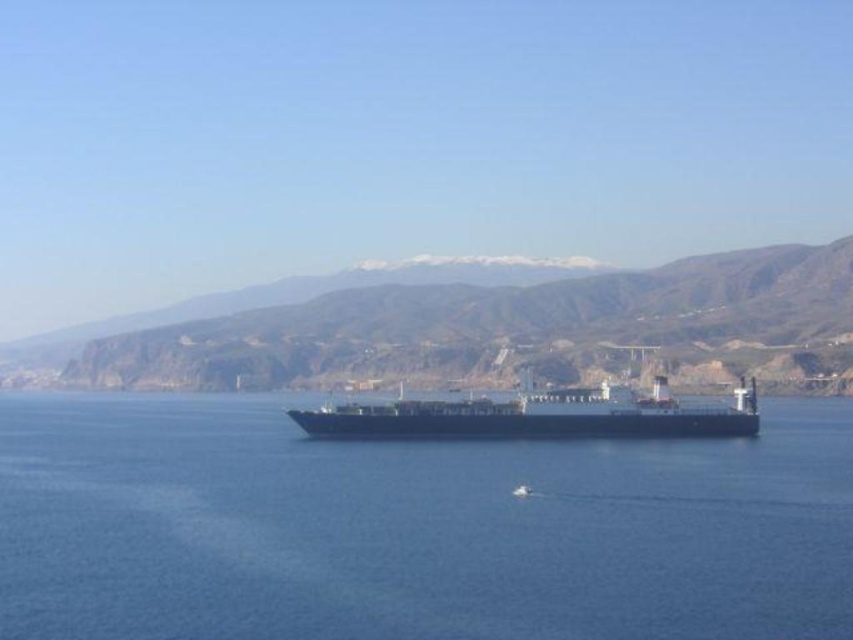
You are standing on the deck of the cargo ship and see two points marked in the image. The first point is at coordinates point (699, 580) and the second point is at point (222, 337). Which point is closer to you?

Point (699, 580) is in front of point (222, 337), so the first point is closer to you.

You are a marine biologist studying the water surface near the black matte cargo ship at center. You need to collect a water sample from the blue water at center. What is the minimum distance you must travel from the ship to reach the water surface?

The minimum distance you must travel from the black matte cargo ship at center to the blue water at center is 43.23 meters.

Based on the photo, you are a sailor on a small boat trying to navigate through the blue water at center where the black matte cargo ship at center is located. Can you safely pass around the ship without getting too close?

The blue water at center has a larger size compared to the black matte cargo ship at center, so there is enough space to safely navigate around the ship without getting too close.